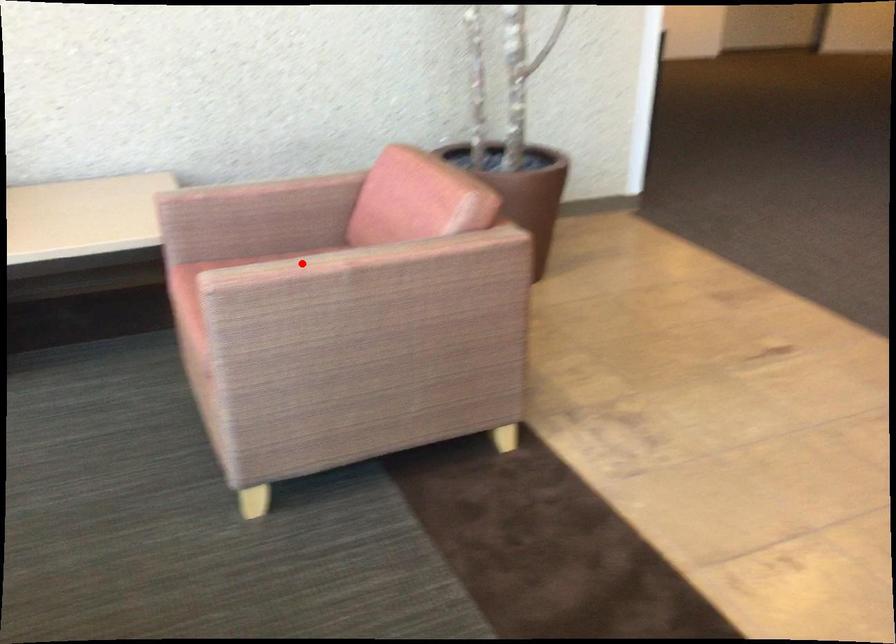
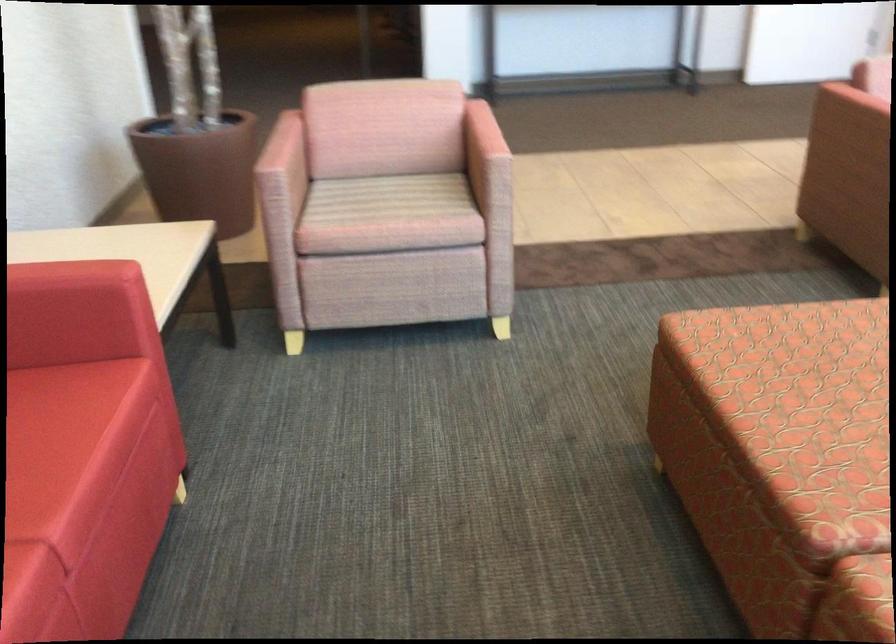
Where in the second image is the point corresponding to the highlighted location from the first image?

(481, 133)